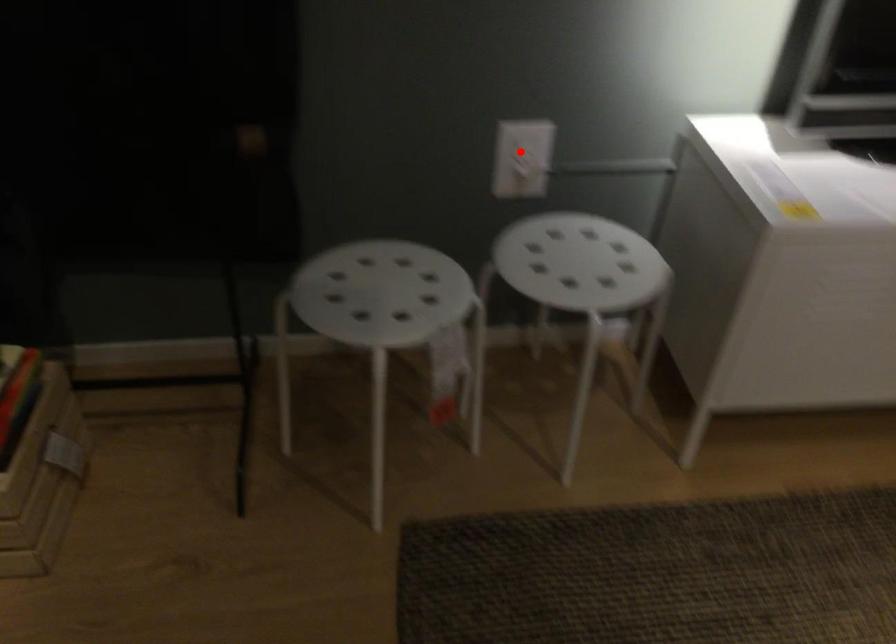
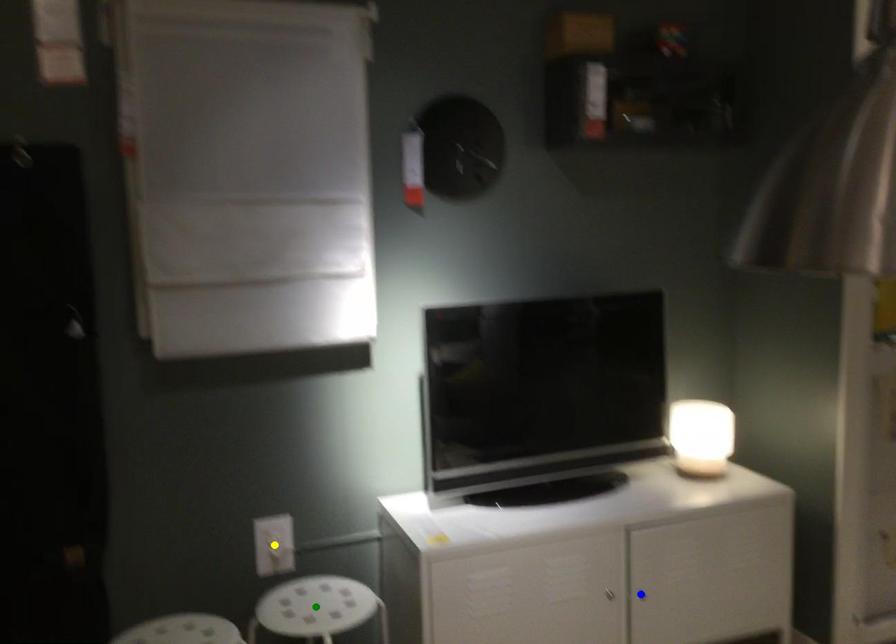
Question: I am providing you with two images of the same scene from different viewpoints. A red point is marked on the first image. You are given multiple points on the second image. In image 2, which mark is for the same physical point as the one in image 1?

Choices:
 (A) blue point
 (B) yellow point
 (C) green point

Answer: (B)